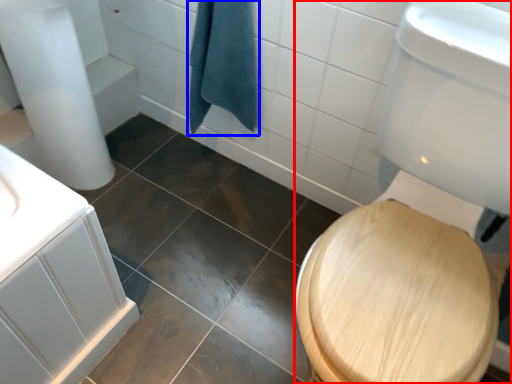
Question: Among these objects, which one is farthest to the camera, toilet bowl (highlighted by a red box) or bath towel (highlighted by a blue box)?

Choices:
 (A) toilet bowl
 (B) bath towel

Answer: (B)